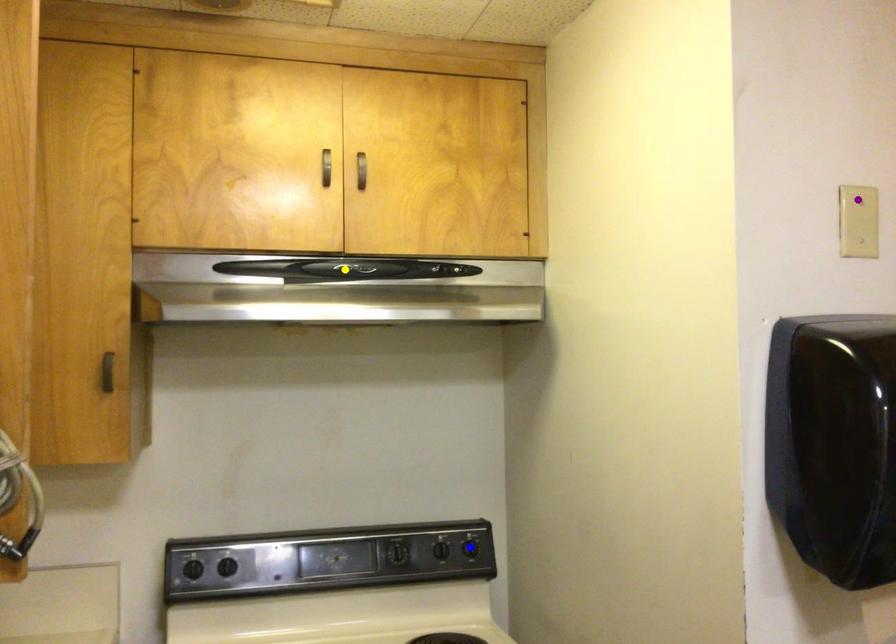
Order these from nearest to farthest:
purple point
yellow point
blue point

1. purple point
2. yellow point
3. blue point